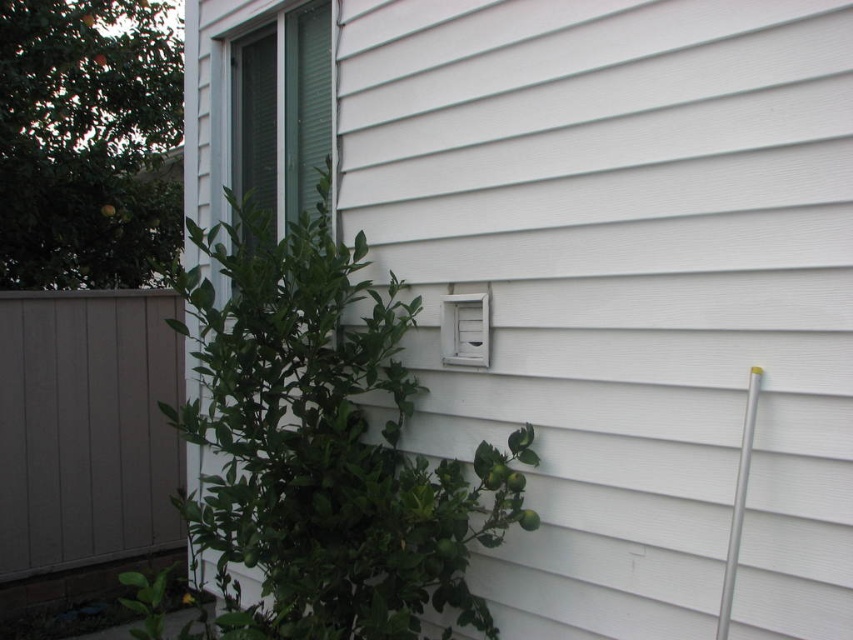
Question: Is the position of green leafy plant at center more distant than that of silver metallic pole at right?

Choices:
 (A) no
 (B) yes

Answer: (B)

Question: Is the position of gray wood fence at left less distant than that of silver metallic pole at right?

Choices:
 (A) yes
 (B) no

Answer: (B)

Question: Which point appears farthest from the camera in this image?

Choices:
 (A) (173, 324)
 (B) (741, 452)
 (C) (163, 433)

Answer: (C)

Question: Does green leafy plant at center have a lesser width compared to silver metallic pole at right?

Choices:
 (A) no
 (B) yes

Answer: (A)

Question: Which is nearer to the silver metallic pole at right?

Choices:
 (A) gray wood fence at left
 (B) green leafy plant at center

Answer: (B)

Question: Which object is closer to the camera taking this photo?

Choices:
 (A) silver metallic pole at right
 (B) green leafy plant at center
 (C) gray wood fence at left

Answer: (A)